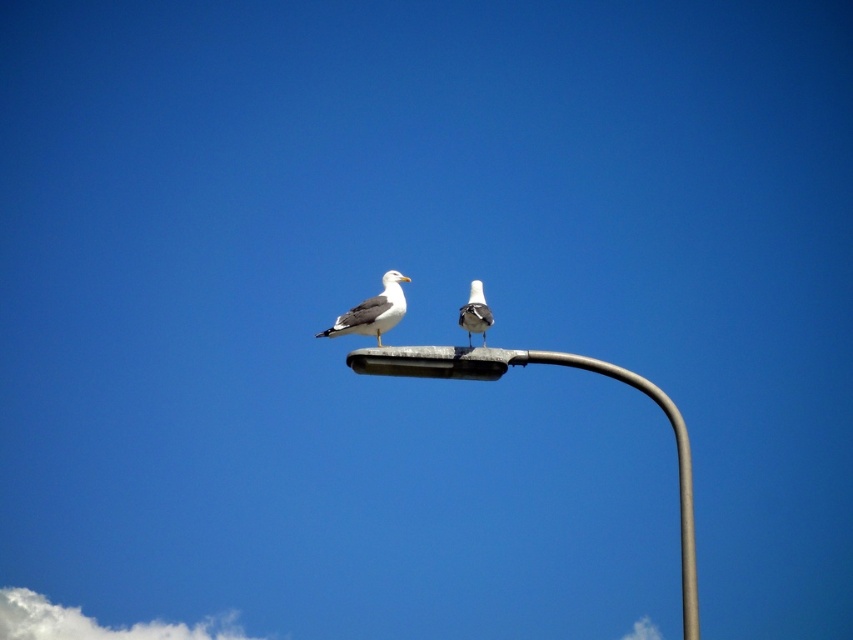
Question: Estimate the real-world distances between objects in this image. Which object is farther from the white matte bird at center?

Choices:
 (A) white matte seagull at center
 (B) satin silver street light at upper center

Answer: (B)

Question: Is satin silver street light at upper center smaller than white matte seagull at center?

Choices:
 (A) yes
 (B) no

Answer: (B)

Question: Estimate the real-world distances between objects in this image. Which object is closer to the white matte seagull at center?

Choices:
 (A) satin silver street light at upper center
 (B) white matte bird at center

Answer: (B)

Question: Is the position of white matte seagull at center less distant than that of white matte bird at center?

Choices:
 (A) yes
 (B) no

Answer: (B)

Question: Which point appears closest to the camera in this image?

Choices:
 (A) (689, 548)
 (B) (471, 298)
 (C) (349, 333)

Answer: (A)

Question: In this image, where is satin silver street light at upper center located relative to white matte seagull at center?

Choices:
 (A) left
 (B) right

Answer: (B)